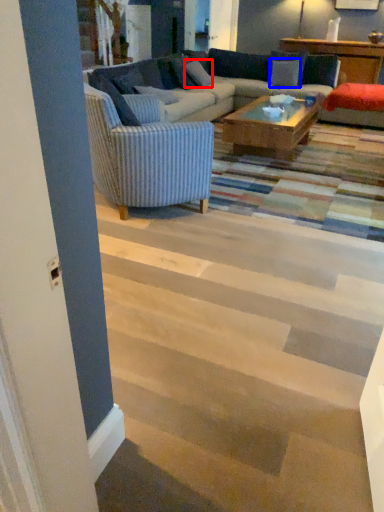
Question: Which of the following is the closest to the observer, pillow (highlighted by a red box) or pillow (highlighted by a blue box)?

Choices:
 (A) pillow
 (B) pillow

Answer: (A)